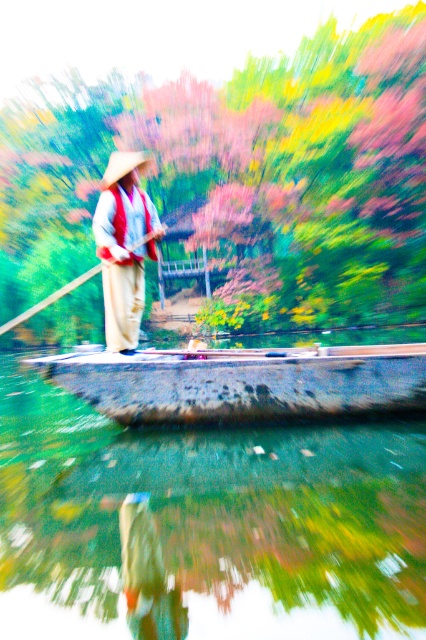
Consider the image. You are standing on the dock and see the green smooth river at center and the matte beige hat at center. Which object is closer to you?

The matte beige hat at center is closer to you because it is positioned above the green smooth river at center, which is below it.

You are standing on the bank of the green smooth river at center and want to reach a small island located 10 feet away from the river. Can you use the boat shown in the scene to reach the island?

The green smooth river at center and viewer are 9.07 feet apart from each other. Since the island is 10 feet away from the river, the boat can be used to reach it as the distance is within a reasonable range for a small boat to navigate.

You are a photographer trying to capture the exact location of the matte beige hat at center in the scene. According to the coordinates provided, where would you focus your camera lens to ensure the hat is centered in your photo?

To center the matte beige hat at center in the photo, focus the camera lens at the coordinates point [123,246].